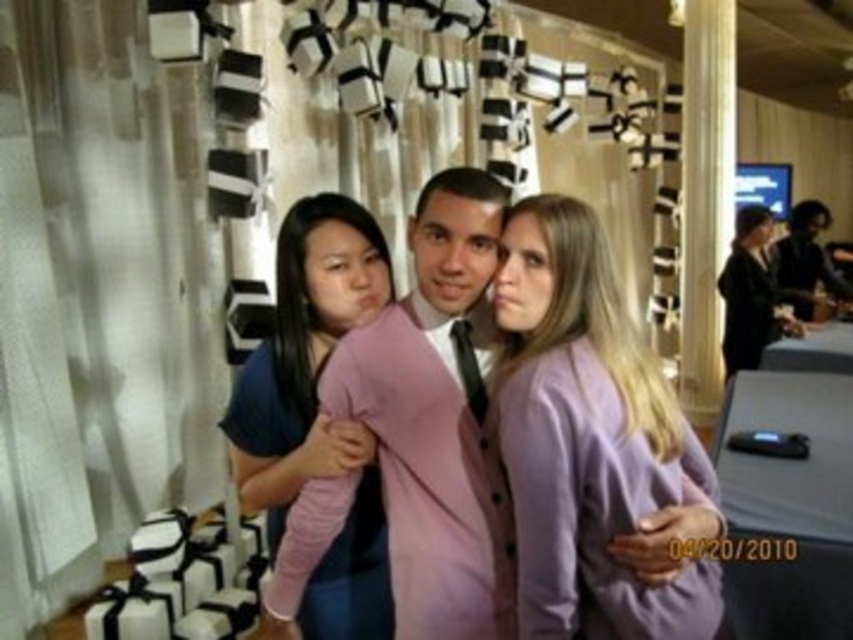
Question: Among these points, which one is farthest from the camera?

Choices:
 (A) (396, 577)
 (B) (524, 625)
 (C) (265, 522)

Answer: (C)

Question: Can you confirm if purple fabric shirt at center is positioned above pink matte sweater at center?

Choices:
 (A) yes
 (B) no

Answer: (A)

Question: Can you confirm if purple fabric shirt at center is positioned to the left of pink matte sweater at center?

Choices:
 (A) no
 (B) yes

Answer: (A)

Question: Considering the relative positions of purple fabric shirt at center and pink matte sweater at center in the image provided, where is purple fabric shirt at center located with respect to pink matte sweater at center?

Choices:
 (A) below
 (B) above

Answer: (B)

Question: Which point is closer to the camera?

Choices:
 (A) (599, 252)
 (B) (691, 502)
 (C) (318, 224)

Answer: (A)

Question: Which object is farther from the camera taking this photo?

Choices:
 (A) purple fabric shirt at center
 (B) pink matte sweater at center
 (C) pink fabric sweater at center

Answer: (B)